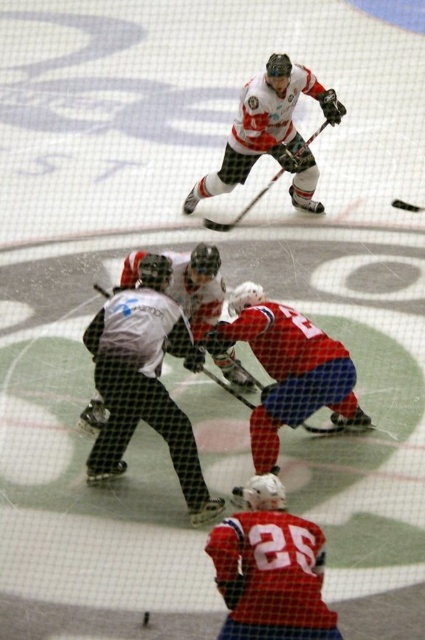
You are a hockey player trying to pass the puck to your teammate. You notice the white mesh referee at center and the matte black hockey stick at center. Which object is closer to your left side?

The white mesh referee at center is to the left of matte black hockey stick at center, so the white mesh referee at center is closer to your left side.

You are a player in the ice hockey game. You see the point marked at coordinates (144, 380). What object is located at that point?

The point at coordinates (144, 380) marks the white mesh referee at center.